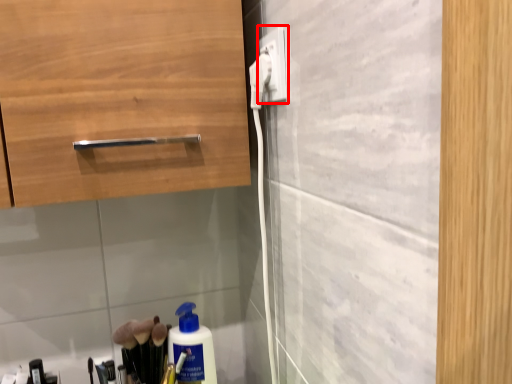
Question: From the image's perspective, what is the correct spatial relationship of electric outlet (annotated by the red box) in relation to electric outlet?

Choices:
 (A) below
 (B) above

Answer: (B)